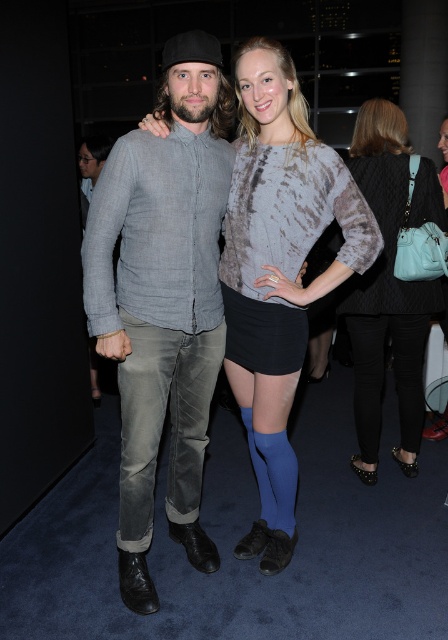
You are a photographer at this social event and want to ensure both the denim shirt at center and the blue tights at center are fully visible in your photo. Given their positions, which one might require you to adjust your camera angle to capture its full height?

The denim shirt at center is taller than blue tights at center, so you might need to adjust your camera angle to capture the full height of the denim shirt at center.

You are organizing a clothing donation drive and need to decide which item takes up less space when folded. Based on the image, which item between the denim shirt at center and the textured gray sweater at center would you choose?

The denim shirt at center is thinner than the textured gray sweater at center, so it would take up less space when folded.